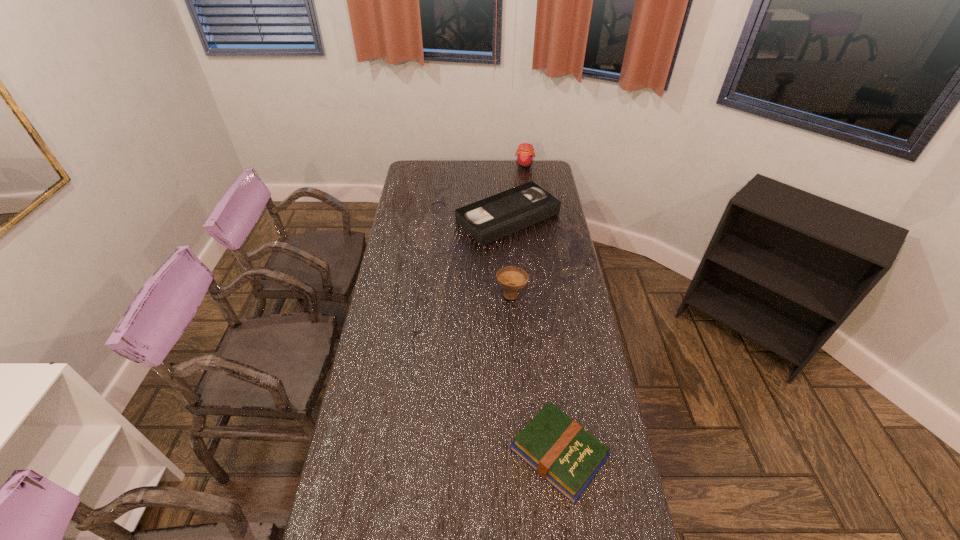
Image resolution: width=960 pixels, height=540 pixels. I want to click on object that is the second closest to the soup bowl, so click(x=560, y=450).